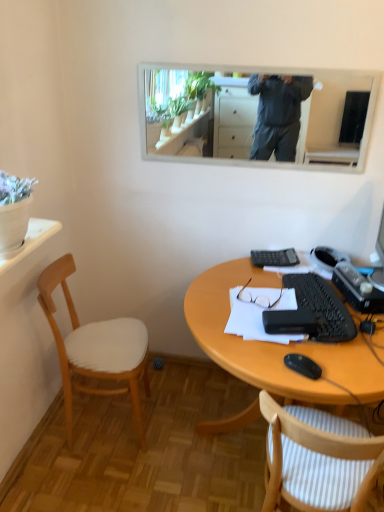
Where is `wooden desk at lower center`? The image size is (384, 512). wooden desk at lower center is located at coordinates (276, 346).

The width and height of the screenshot is (384, 512). Describe the element at coordinates (256, 115) in the screenshot. I see `white framed mirror at upper center` at that location.

What do you see at coordinates (259, 313) in the screenshot?
I see `white paper at center` at bounding box center [259, 313].

What are the coordinates of `black plastic mouse at lower right` in the screenshot? It's located at (303, 365).

Would you say black plastic mouse at lower right is a long distance from white paper at center?

No, there isn't a large distance between black plastic mouse at lower right and white paper at center.

Is white paper at center completely or partially inside black plastic mouse at lower right?

No, white paper at center is located outside of black plastic mouse at lower right.

Does point (319, 372) come in front of point (278, 298)?

Yes, it is.

Looking at this image, from a real-world perspective, between black plastic mouse at lower right and white paper at center, who is vertically higher?

white paper at center, from a real-world perspective.

Which of these two, white striped fabric chair at lower right, which is the 1th chair from right to left, or wooden chair with white cushion at left, the 2th chair positioned from the right, stands shorter?

white striped fabric chair at lower right, which is the 1th chair from right to left, is shorter.

From a real-world perspective, who is located lower, white striped fabric chair at lower right, marked as the second chair in a left-to-right arrangement, or wooden chair with white cushion at left, which is counted as the 1th chair, starting from the left?

In real-world perspective, white striped fabric chair at lower right, marked as the second chair in a left-to-right arrangement, is lower.

Locate an element on the screen. The height and width of the screenshot is (512, 384). chair on the right of wooden chair with white cushion at left, the 2th chair positioned from the right is located at coordinates (318, 459).

Visually, is white striped fabric chair at lower right, marked as the second chair in a left-to-right arrangement, positioned to the left or to the right of wooden chair with white cushion at left, which is counted as the 1th chair, starting from the left?

From the image, it's evident that white striped fabric chair at lower right, marked as the second chair in a left-to-right arrangement, is to the right of wooden chair with white cushion at left, which is counted as the 1th chair, starting from the left.

Is white framed mirror at upper center positioned with its back to black plastic mouse at lower right?

That's not correct — white framed mirror at upper center is not looking away from black plastic mouse at lower right.

Based on the photo, from a real-world perspective, is white framed mirror at upper center over black plastic mouse at lower right?

Yes, from a real-world perspective, white framed mirror at upper center is on top of black plastic mouse at lower right.

Which is correct: white framed mirror at upper center is inside black plastic mouse at lower right, or outside of it?

white framed mirror at upper center lies outside black plastic mouse at lower right.

Is black plastic keyboard at center right situated inside wooden chair with white cushion at left, the 2th chair positioned from the right, or outside?

black plastic keyboard at center right is located beyond the bounds of wooden chair with white cushion at left, the 2th chair positioned from the right.

Who is smaller, black plastic keyboard at center right or wooden chair with white cushion at left, which is counted as the 1th chair, starting from the left?

Smaller between the two is black plastic keyboard at center right.

Considering the sizes of black plastic keyboard at center right and wooden chair with white cushion at left, which is counted as the 1th chair, starting from the left, in the image, is black plastic keyboard at center right taller or shorter than wooden chair with white cushion at left, which is counted as the 1th chair, starting from the left,?

black plastic keyboard at center right is shorter than wooden chair with white cushion at left, which is counted as the 1th chair, starting from the left.

In the scene shown: Considering the sizes of objects black plastic keyboard at center right and wooden chair with white cushion at left, the 2th chair positioned from the right, in the image provided, who is thinner, black plastic keyboard at center right or wooden chair with white cushion at left, the 2th chair positioned from the right,?

black plastic keyboard at center right.

Can you confirm if white striped fabric chair at lower right, marked as the second chair in a left-to-right arrangement, is wider than white paper at center?

Indeed, white striped fabric chair at lower right, marked as the second chair in a left-to-right arrangement, has a greater width compared to white paper at center.

Is the surface of white striped fabric chair at lower right, which is the 1th chair from right to left, in direct contact with white paper at center?

No, white striped fabric chair at lower right, which is the 1th chair from right to left, is not making contact with white paper at center.

Is point (310, 463) less distant than point (277, 298)?

Yes.

Between white striped fabric chair at lower right, marked as the second chair in a left-to-right arrangement, and white paper at center, which one is positioned behind?

white paper at center is more distant.

Does black plastic mouse at lower right appear on the left side of wooden chair with white cushion at left, the 2th chair positioned from the right?

Incorrect, black plastic mouse at lower right is not on the left side of wooden chair with white cushion at left, the 2th chair positioned from the right.

Considering the relative sizes of black plastic mouse at lower right and wooden chair with white cushion at left, which is counted as the 1th chair, starting from the left, in the image provided, is black plastic mouse at lower right taller than wooden chair with white cushion at left, which is counted as the 1th chair, starting from the left,?

No.

Identify the location of mouse in front of the wooden chair with white cushion at left, the 2th chair positioned from the right. This screenshot has width=384, height=512. (303, 365).

Could you tell me if black plastic mouse at lower right is facing wooden chair with white cushion at left, the 2th chair positioned from the right?

No, black plastic mouse at lower right is not oriented towards wooden chair with white cushion at left, the 2th chair positioned from the right.

From the image's perspective, between wooden chair with white cushion at left, which is counted as the 1th chair, starting from the left, and black plastic keyboard at center right, who is located below?

From the image's view, wooden chair with white cushion at left, which is counted as the 1th chair, starting from the left, is below.

How different are the orientations of wooden chair with white cushion at left, which is counted as the 1th chair, starting from the left, and black plastic keyboard at center right in degrees?

The facing directions of wooden chair with white cushion at left, which is counted as the 1th chair, starting from the left, and black plastic keyboard at center right are 178 degrees apart.

How much distance is there between wooden chair with white cushion at left, which is counted as the 1th chair, starting from the left, and black plastic keyboard at center right?

wooden chair with white cushion at left, which is counted as the 1th chair, starting from the left, and black plastic keyboard at center right are 82.69 centimeters apart from each other.

You are a GUI agent. You are given a task and a screenshot of the screen. Output one action in this format:
    pyautogui.click(x=<x>, y=<y>)
    Task: Click on the chair located behind the black plastic keyboard at center right
    The height and width of the screenshot is (512, 384).
    Given the screenshot: What is the action you would take?
    pyautogui.click(x=95, y=348)

Find the location of `notepad on the left of black plastic mouse at lower right`. notepad on the left of black plastic mouse at lower right is located at coordinates (259, 313).

This screenshot has height=512, width=384. I want to click on chair below the wooden chair with white cushion at left, the 2th chair positioned from the right (from the image's perspective), so pos(318,459).

Considering their positions, is wooden desk at lower center positioned closer to white striped fabric chair at lower right, which is the 1th chair from right to left, than white framed mirror at upper center?

wooden desk at lower center is positioned closer to the anchor white striped fabric chair at lower right, which is the 1th chair from right to left.

Looking at the image, which one is located closer to black plastic keyboard at center right, wooden chair with white cushion at left, which is counted as the 1th chair, starting from the left, or white paper at center?

Based on the image, white paper at center appears to be nearer to black plastic keyboard at center right.

From the image, which object appears to be nearer to wooden desk at lower center, black plastic mouse at lower right or white paper at center?

white paper at center is positioned closer to the anchor wooden desk at lower center.

Considering their positions, is white paper at center positioned closer to wooden chair with white cushion at left, which is counted as the 1th chair, starting from the left, than white striped fabric chair at lower right, marked as the second chair in a left-to-right arrangement?

The object closer to wooden chair with white cushion at left, which is counted as the 1th chair, starting from the left, is white paper at center.

Which object lies nearer to the anchor point black plastic mouse at lower right, white striped fabric chair at lower right, which is the 1th chair from right to left, or white framed mirror at upper center?

white striped fabric chair at lower right, which is the 1th chair from right to left, is closer to black plastic mouse at lower right.

Based on their spatial positions, is wooden desk at lower center or white framed mirror at upper center closer to white paper at center?

Based on the image, wooden desk at lower center appears to be nearer to white paper at center.

From the image, which object appears to be farther from wooden desk at lower center, black plastic keyboard at center right or black plastic mouse at lower right?

black plastic mouse at lower right lies further to wooden desk at lower center than the other object.

Consider the image. Estimate the real-world distances between objects in this image. Which object is further from white framed mirror at upper center, white paper at center or wooden chair with white cushion at left, the 2th chair positioned from the right?

wooden chair with white cushion at left, the 2th chair positioned from the right.

The height and width of the screenshot is (512, 384). Identify the location of mouse between black plastic keyboard at center right and white striped fabric chair at lower right, marked as the second chair in a left-to-right arrangement, in the up-down direction. (303, 365).

Locate an element on the screen. This screenshot has width=384, height=512. notepad situated between wooden chair with white cushion at left, which is counted as the 1th chair, starting from the left, and white striped fabric chair at lower right, marked as the second chair in a left-to-right arrangement, from left to right is located at coordinates (259, 313).

This screenshot has width=384, height=512. Identify the location of chair between white framed mirror at upper center and white striped fabric chair at lower right, marked as the second chair in a left-to-right arrangement, in the up-down direction. (95, 348).

The height and width of the screenshot is (512, 384). I want to click on mouse between black plastic keyboard at center right and wooden desk at lower center in the up-down direction, so click(303, 365).